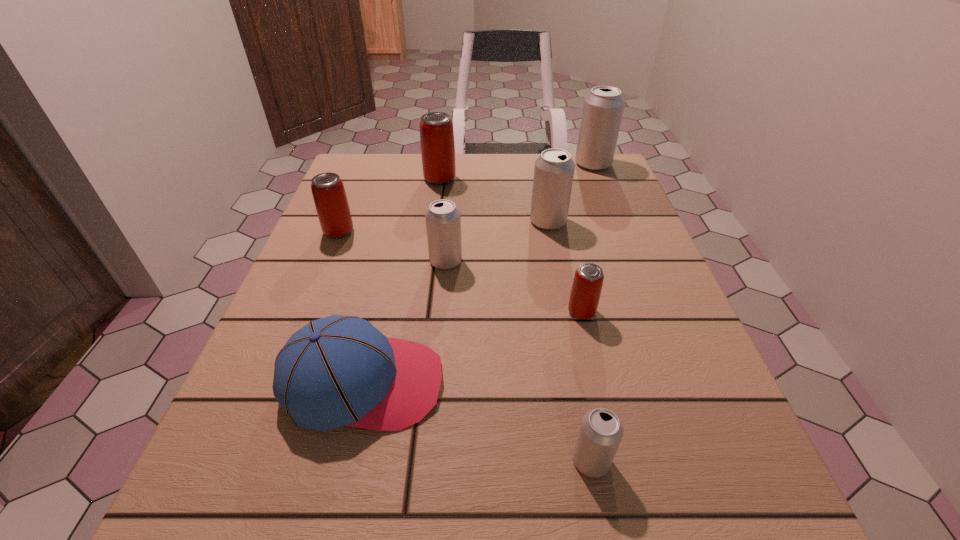
Identify the location of the second nearest object. Image resolution: width=960 pixels, height=540 pixels. (336, 371).

Image resolution: width=960 pixels, height=540 pixels. What are the coordinates of `the rightmost pink beer can` in the screenshot? It's located at point(588,280).

Locate an element on the screen. the sixth farthest object is located at coordinates (588, 280).

Locate an element on the screen. The height and width of the screenshot is (540, 960). the nearest object is located at coordinates (601, 431).

Find the location of a particular element. The image size is (960, 540). the smallest white beer can is located at coordinates (601, 431).

Locate an element on the screen. The height and width of the screenshot is (540, 960). vacant region located on the left of the rightmost beer can is located at coordinates (469, 164).

The width and height of the screenshot is (960, 540). What are the coordinates of `free space located on the front of the farthest pink beer can` in the screenshot? It's located at click(x=436, y=209).

Where is `vacant space located 0.240m on the front of the third smallest white beer can`? The image size is (960, 540). vacant space located 0.240m on the front of the third smallest white beer can is located at coordinates (565, 310).

Identify the location of vacant space situated on the right of the second farthest pink beer can. (426, 232).

Image resolution: width=960 pixels, height=540 pixels. What are the coordinates of `free space located on the front of the second nearest white beer can` in the screenshot? It's located at (438, 356).